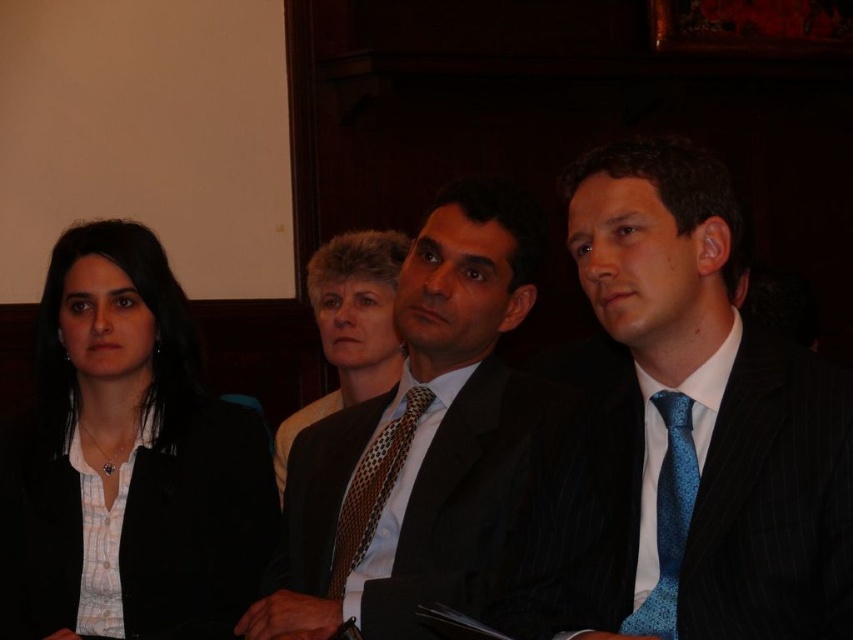
Question: Does matte black jacket at left appear on the left side of brown dotted tie at center?

Choices:
 (A) yes
 (B) no

Answer: (A)

Question: In this image, where is matte black jacket at left located relative to brown dotted tie at center?

Choices:
 (A) left
 (B) right

Answer: (A)

Question: Which object appears closest to the camera in this image?

Choices:
 (A) blue silk tie at center
 (B) brown dotted tie at center
 (C) blue textured tie at right
 (D) matte white shirt at center

Answer: (A)

Question: Which object appears closest to the camera in this image?

Choices:
 (A) brown dotted tie at center
 (B) blue textured tie at right
 (C) blue silk tie at center
 (D) dark brown suit at center

Answer: (C)

Question: Which of the following is the farthest from the observer?

Choices:
 (A) brown dotted tie at center
 (B) matte white shirt at center

Answer: (B)

Question: Does blue silk tie at center have a lesser width compared to brown dotted tie at center?

Choices:
 (A) yes
 (B) no

Answer: (B)